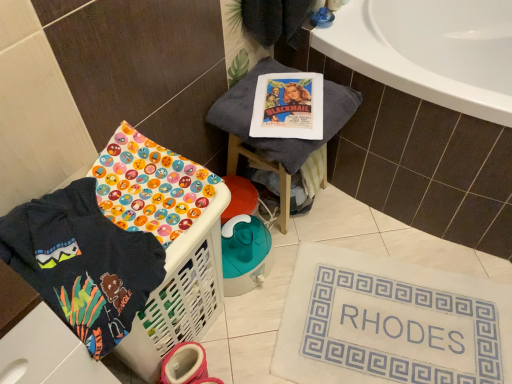
Question: Is white plastic laundry basket at lower left in front of or behind gray fabric stool at upper center in the image?

Choices:
 (A) front
 (B) behind

Answer: (A)

Question: Which is correct: white plastic laundry basket at lower left is inside gray fabric stool at upper center, or outside of it?

Choices:
 (A) outside
 (B) inside

Answer: (A)

Question: Based on their relative distances, which object is farther from the white plastic laundry basket at lower left?

Choices:
 (A) dark blue fabric at lower left
 (B) gray fabric stool at upper center
 (C) white fabric bath mat at lower right

Answer: (C)

Question: Which of these objects is positioned closest to the white plastic laundry basket at lower left?

Choices:
 (A) dark blue fabric at lower left
 (B) gray fabric stool at upper center
 (C) white fabric bath mat at lower right

Answer: (A)